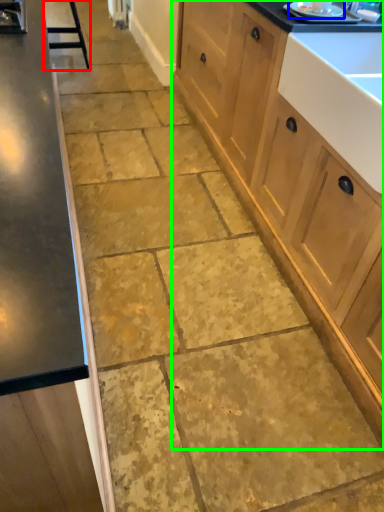
Question: Based on their relative distances, which object is farther from bar stool (highlighted by a red box)? Choose from appliance (highlighted by a blue box) and cabinetry (highlighted by a green box).

Choices:
 (A) appliance
 (B) cabinetry

Answer: (A)